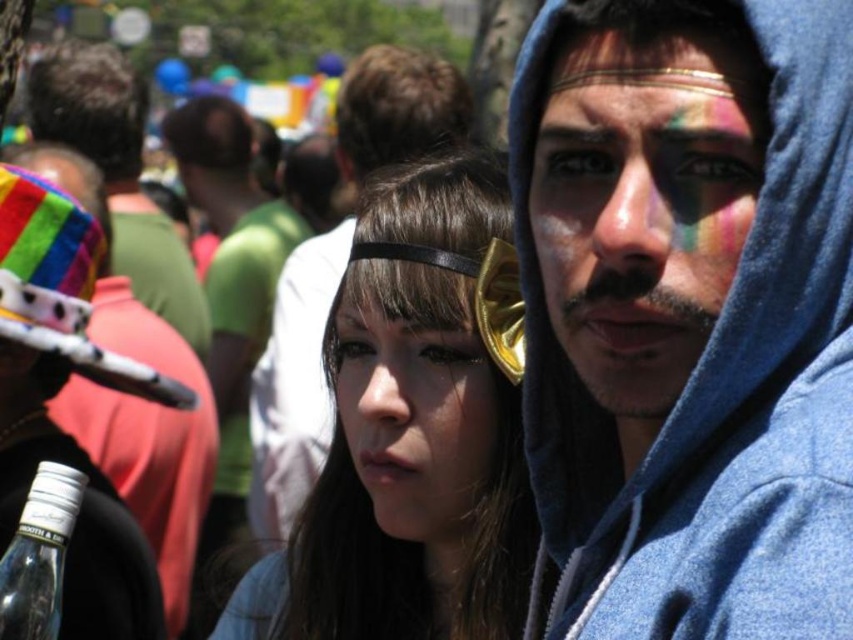
Is point (541, 257) positioned in front of point (213, 161)?

Yes.

Does rainbow painted face at center have a lesser height compared to matte black hat at center?

Yes.

Identify the location of rainbow painted face at center. The image size is (853, 640). (643, 204).

I want to click on rainbow painted face at center, so click(643, 204).

Can you confirm if blue fleece hoodie at center is positioned below matte black hair at center?

Actually, blue fleece hoodie at center is above matte black hair at center.

Does blue fleece hoodie at center have a greater height compared to matte black hair at center?

Indeed, blue fleece hoodie at center has a greater height compared to matte black hair at center.

Which is in front, point (727, 490) or point (463, 522)?

Point (727, 490)

Identify the location of blue fleece hoodie at center. (717, 392).

Is rainbow painted face at center positioned in front of rainbow fabric headdress at upper left?

Yes, rainbow painted face at center is in front of rainbow fabric headdress at upper left.

Between point (659, 49) and point (68, 113), which one is positioned behind?

The point (68, 113) is more distant.

At what (x,y) coordinates should I click in order to perform the action: click on rainbow painted face at center. Please return your answer as a coordinate pair (x, y). Looking at the image, I should click on (643, 204).